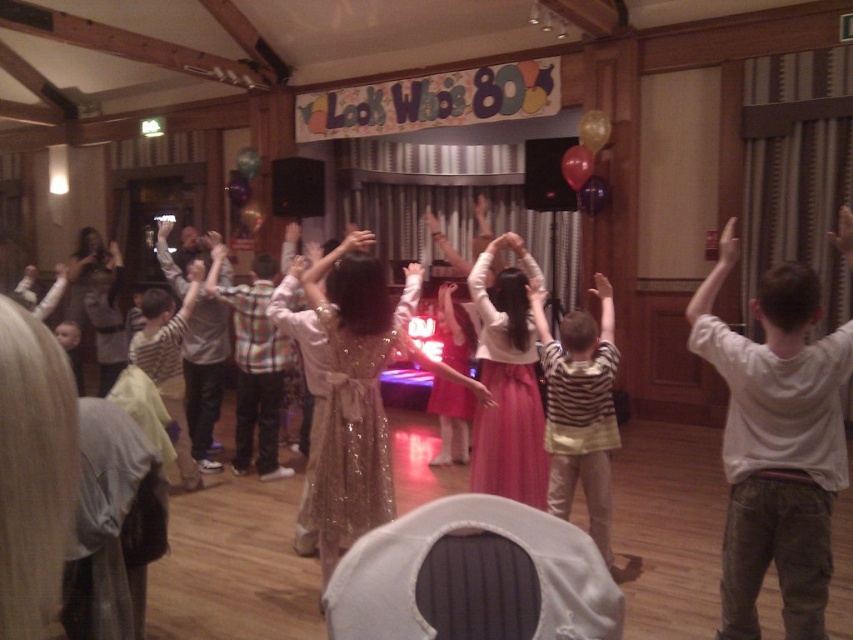
You are at a party and see a child wearing a white cotton shirt at center and a translucent purple balloon at upper center. Which object is located to the left of the other?

The white cotton shirt at center is positioned on the left side of translucent purple balloon at upper center.

You are at a party and see two balloons at the top of the room. The gold metallic balloon at upper center and the translucent purple balloon at upper center. Which one is higher?

The gold metallic balloon at upper center is higher than the translucent purple balloon at upper center.

You are at a party and see two balloons at the top of the image. Which balloon is closer to you, the gold metallic balloon at upper center or the translucent purple balloon at upper center?

The gold metallic balloon at upper center is closer to you because it is in front of the translucent purple balloon at upper center.